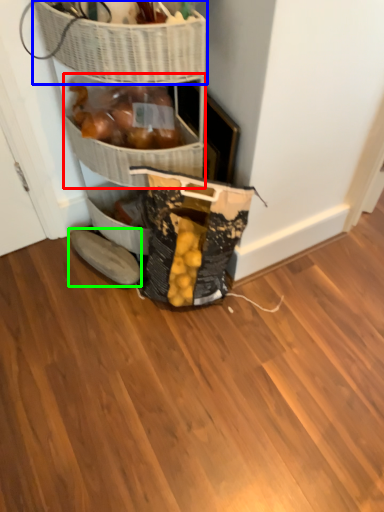
Question: Which is farther away from basket (highlighted by a red box)? basket (highlighted by a blue box) or footwear (highlighted by a green box)?

Choices:
 (A) basket
 (B) footwear

Answer: (B)